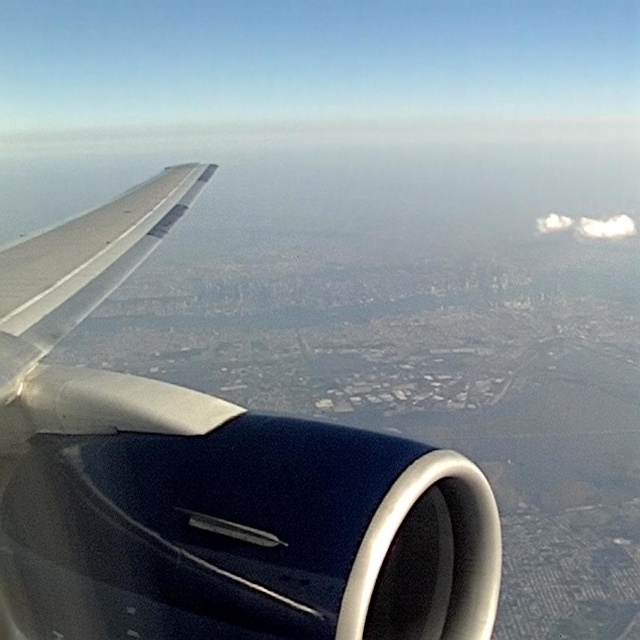
Question: Can you confirm if metallic blue engine at center is positioned to the right of white fluffy cloud at upper right?

Choices:
 (A) yes
 (B) no

Answer: (B)

Question: Is metallic blue engine at center to the right of white fluffy cloud at upper right from the viewer's perspective?

Choices:
 (A) yes
 (B) no

Answer: (B)

Question: Among these points, which one is farthest from the camera?

Choices:
 (A) (564, 216)
 (B) (180, 628)

Answer: (A)

Question: Which point is farther to the camera?

Choices:
 (A) (608, 228)
 (B) (452, 506)

Answer: (A)

Question: Does metallic blue engine at center have a smaller size compared to white fluffy cloud at upper right?

Choices:
 (A) yes
 (B) no

Answer: (A)